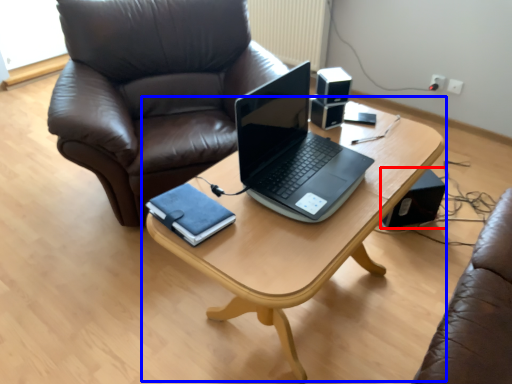
Question: Which point is closer to the camera, speaker (highlighted by a red box) or table (highlighted by a blue box)?

Choices:
 (A) speaker
 (B) table

Answer: (B)